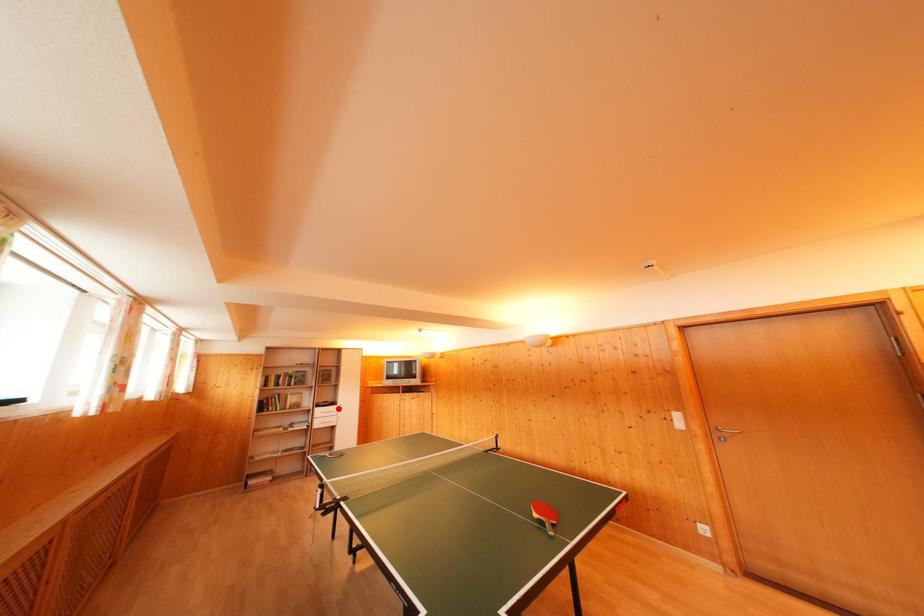
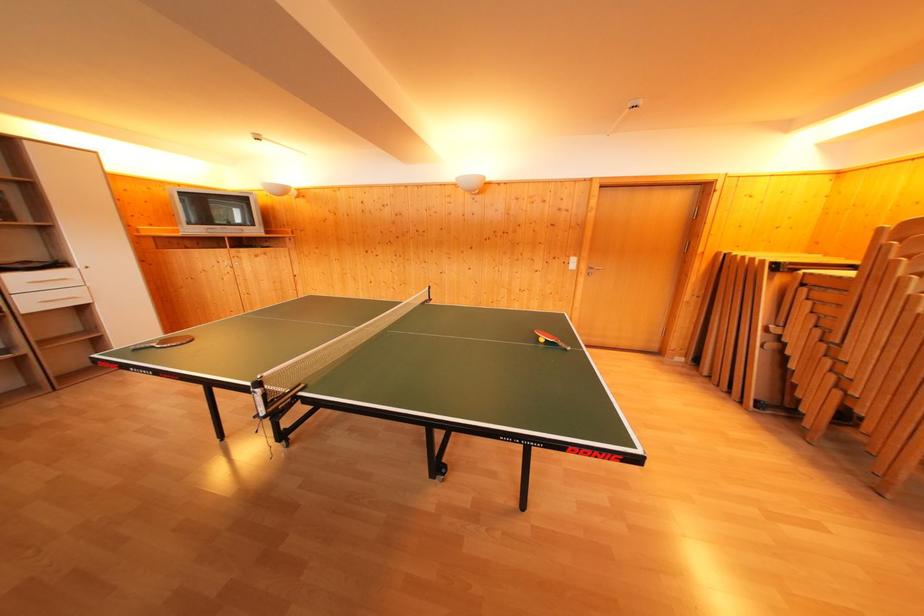
Question: I am providing you with two images of the same scene from different viewpoints. Given a red point in image1, look at the same physical point in image2. Is it:

Choices:
 (A) Closer to the viewpoint
 (B) Farther from the viewpoint

Answer: (A)